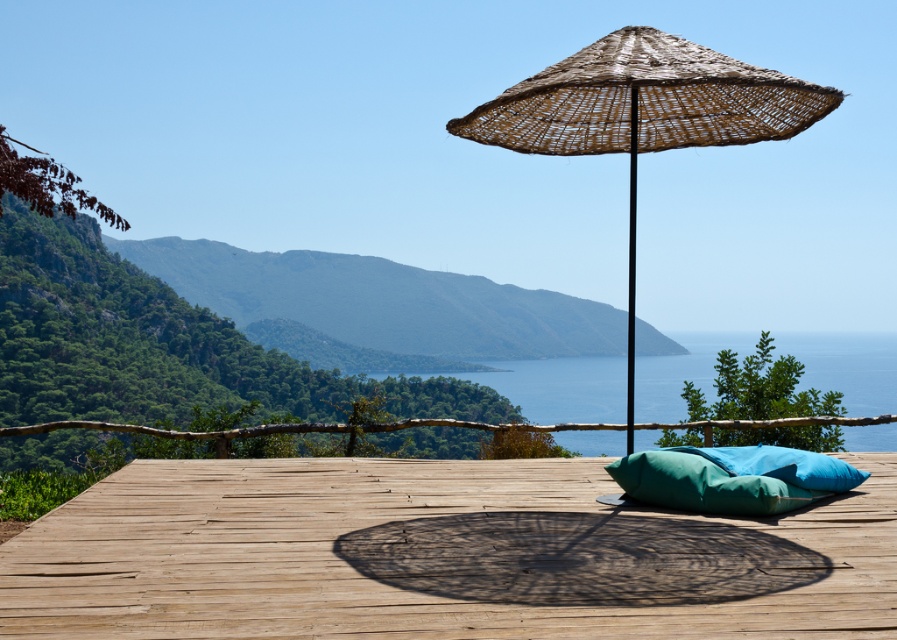
You are a delivery person trying to place a package on the wooden deck at center. There is a teal fabric cushion at center in the way. Can you slide the cushion aside to make space for the package?

The distance between wooden deck at center and teal fabric cushion at center is 32.89 inches, so yes, you can slide the teal fabric cushion at center aside to create space for the package.

You are planning to place a large potted plant on the deck. The plant requires a space wider than the green leafy mountain at center. Can the space under the woven straw umbrella at center accommodate it?

The green leafy mountain at center is narrower than the woven straw umbrella at center. Since the plant needs a space wider than the green leafy mountain at center, the space under the woven straw umbrella at center can accommodate it because it is wider.

You are standing on the wooden deck and want to place a 2.5 meter long bench between the green leafy mountain at center and the teal cushion. Is there enough space?

The distance between the green leafy mountain at center and the teal cushion is 25.36 meters. Since the bench is only 2.5 meters long, there is ample space to place it between them.